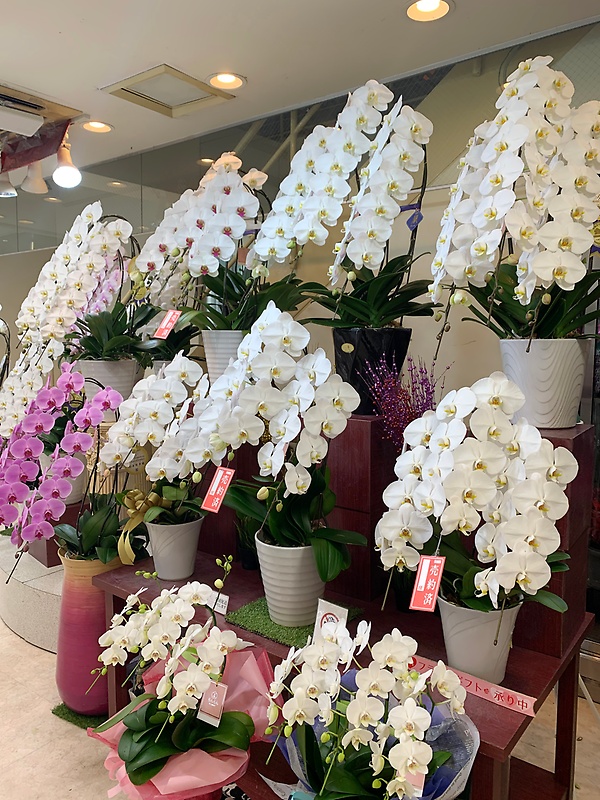
This screenshot has width=600, height=800. I want to click on mirrors, so click(x=46, y=220).